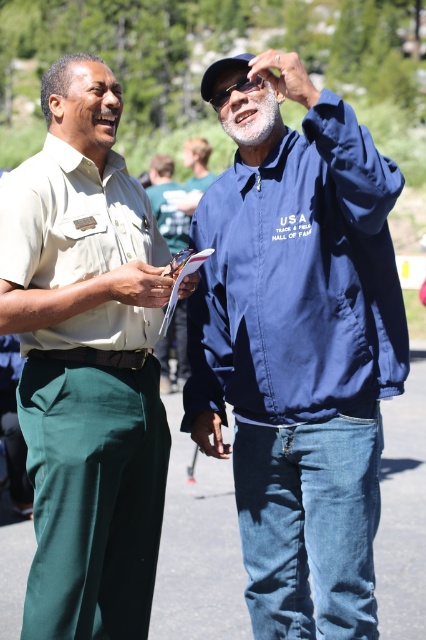
Which is in front, point (204, 340) or point (100, 182)?

Point (100, 182)

Between point (199, 392) and point (37, 410), which one is positioned in front?

Point (37, 410) is more forward.

Locate an element on the screen. blue fabric jacket at upper right is located at coordinates (296, 342).

Between blue fabric jacket at upper right and blue matte jacket at center, which one has less height?

With less height is blue matte jacket at center.

Where is `blue fabric jacket at upper right`? The image size is (426, 640). blue fabric jacket at upper right is located at coordinates (296, 342).

This screenshot has width=426, height=640. In order to click on blue fabric jacket at upper right in this screenshot , I will do `click(296, 342)`.

Is matte khaki shirt at left above blue matte jacket at center?

Correct, matte khaki shirt at left is located above blue matte jacket at center.

Is matte khaki shirt at left thinner than blue matte jacket at center?

No.

Does point (45, 608) come in front of point (172, 164)?

Yes, it is.

This screenshot has height=640, width=426. Find the location of `matte khaki shirt at left`. matte khaki shirt at left is located at coordinates point(86,362).